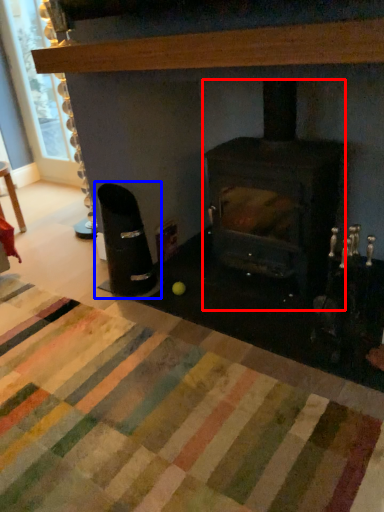
Question: Which of the following is the closest to the observer, wood burning stove (highlighted by a red box) or armchair (highlighted by a blue box)?

Choices:
 (A) wood burning stove
 (B) armchair

Answer: (A)